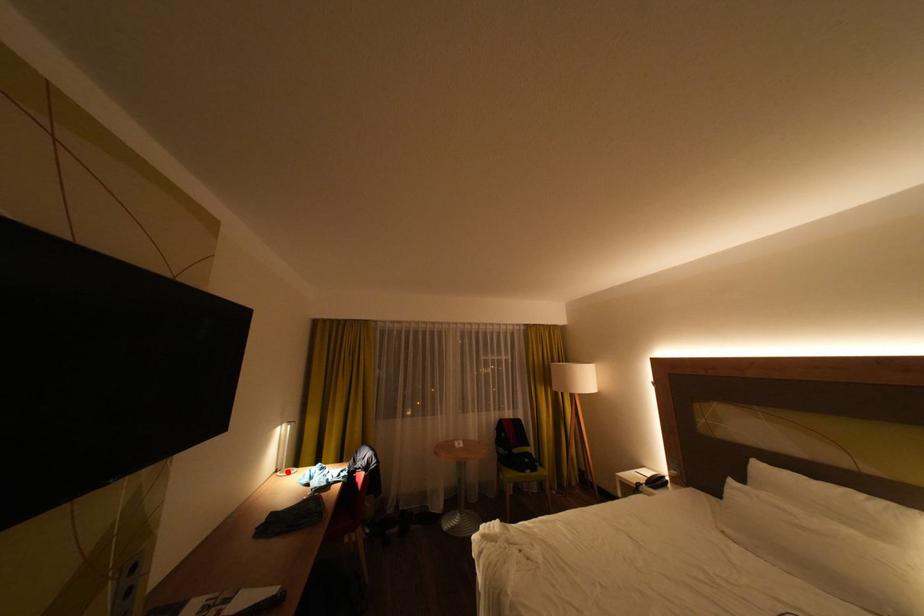
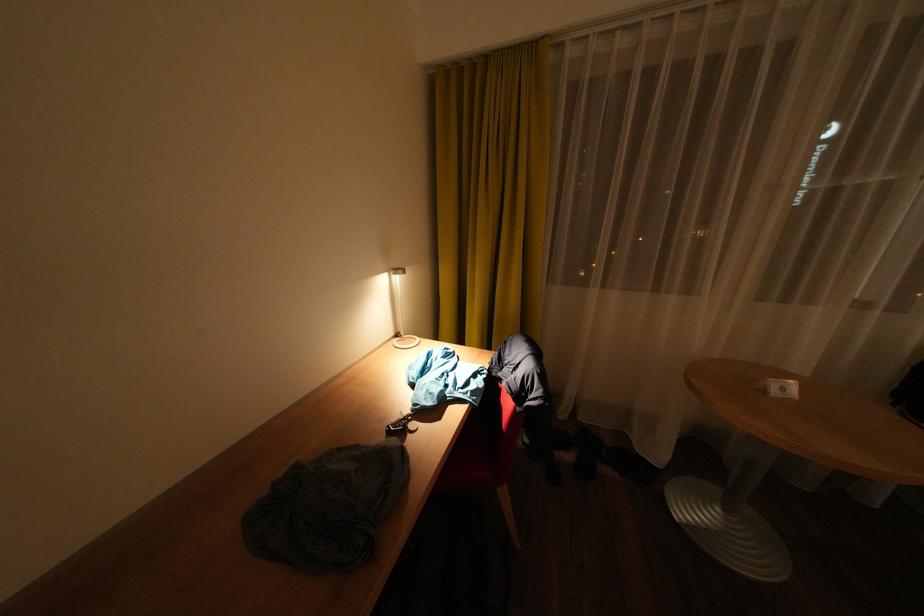
Question: I am providing you with two images of the same scene from different viewpoints. A red point is marked on the first image. Is the red point's position out of view in image 2?

Choices:
 (A) Yes
 (B) No

Answer: (B)